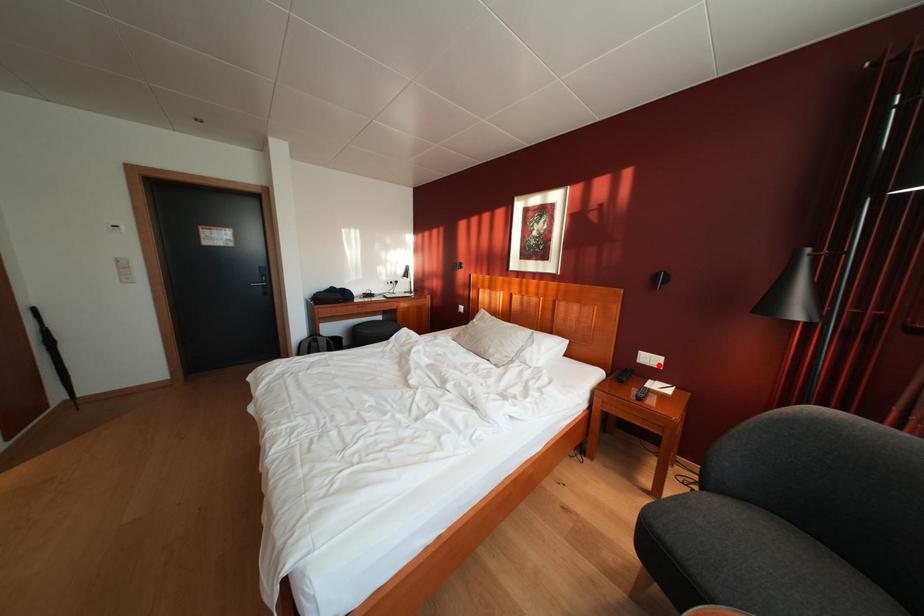
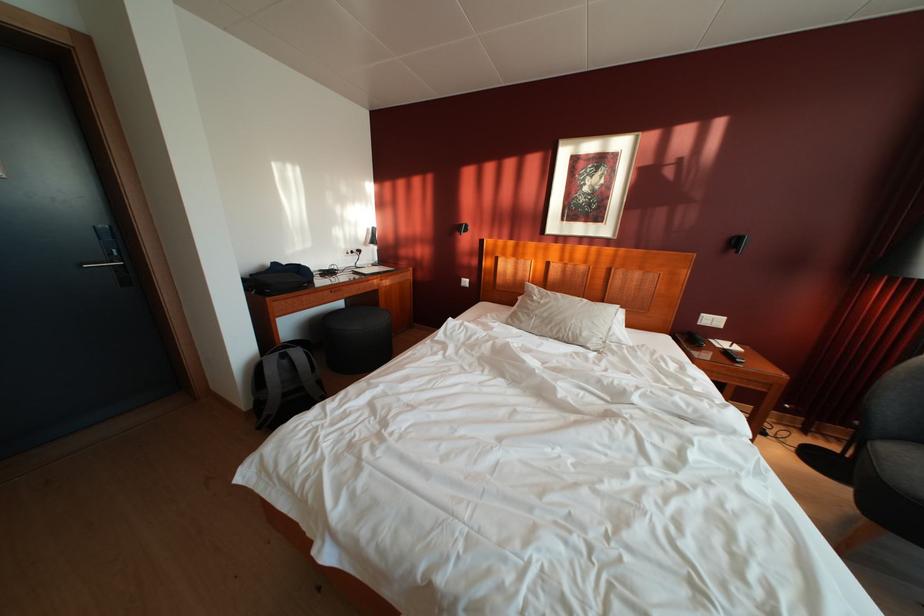
Where in the second image is the point corresponding to the highlighted location from the first image?

(721, 326)